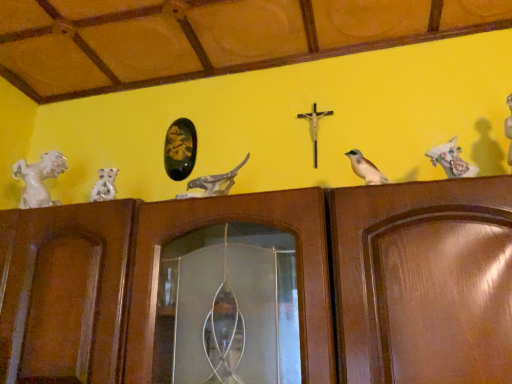
Question: In terms of height, does metallic gold crucifix at center look taller or shorter compared to brown wood door at center?

Choices:
 (A) short
 (B) tall

Answer: (A)

Question: From the image's perspective, relative to brown wood door at center, is metallic gold crucifix at center above or below?

Choices:
 (A) below
 (B) above

Answer: (B)

Question: Based on their relative distances, which object is farther from the brown wood door at center?

Choices:
 (A) gold leaf painting at center
 (B) brown matte bird at center
 (C) white glossy horse at left, which is the fourth animal from right to left
 (D) white glossy statue at left, the 2th animal positioned from the left
 (E) white glossy horse at upper right, placed as the 1th animal when sorted from right to left

Answer: (E)

Question: Estimate the real-world distances between objects in this image. Which object is closer to the white glossy statue at left, which is the third animal in right-to-left order?

Choices:
 (A) brown matte bird at center
 (B) metallic gold crucifix at center
 (C) matte gray stone bird at center, the 2th animal when ordered from right to left
 (D) brown wood door at center
 (E) white glossy horse at left, arranged as the first animal when viewed from the left

Answer: (E)